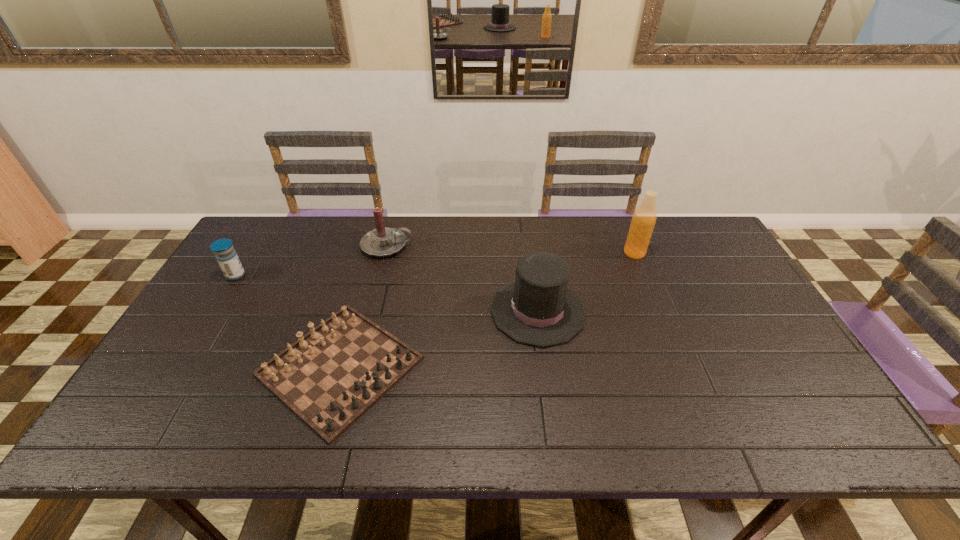
The width and height of the screenshot is (960, 540). I want to click on free location at the left edge, so click(x=210, y=394).

You are a GUI agent. You are given a task and a screenshot of the screen. Output one action in this format:
    pyautogui.click(x=<x>, y=<y>)
    Task: Click on the free space at the right edge
    
    Given the screenshot: What is the action you would take?
    pyautogui.click(x=687, y=266)

At what (x,y) coordinates should I click in order to perform the action: click on blank area at the far right corner. Please return your answer as a coordinate pair (x, y). The width and height of the screenshot is (960, 540). Looking at the image, I should click on (690, 238).

This screenshot has width=960, height=540. Identify the location of free space between the tallest object and the candle. (511, 249).

Locate an element on the screen. vacant region between the candle and the second object from right to left is located at coordinates (463, 279).

This screenshot has height=540, width=960. I want to click on free area in between the medicine and the dress hat, so click(387, 293).

You are a GUI agent. You are given a task and a screenshot of the screen. Output one action in this format:
    pyautogui.click(x=<x>, y=<y>)
    Task: Click on the free space between the chessboard and the second object from right to left
    The width and height of the screenshot is (960, 540).
    Given the screenshot: What is the action you would take?
    pyautogui.click(x=439, y=339)

This screenshot has height=540, width=960. I want to click on vacant area between the fourth tallest object and the beer bottle, so click(435, 264).

Locate an element on the screen. The image size is (960, 540). vacant space that is in between the rightmost object and the candle is located at coordinates (511, 249).

The image size is (960, 540). Identify the location of vacant area between the fourth tallest object and the dress hat. (387, 293).